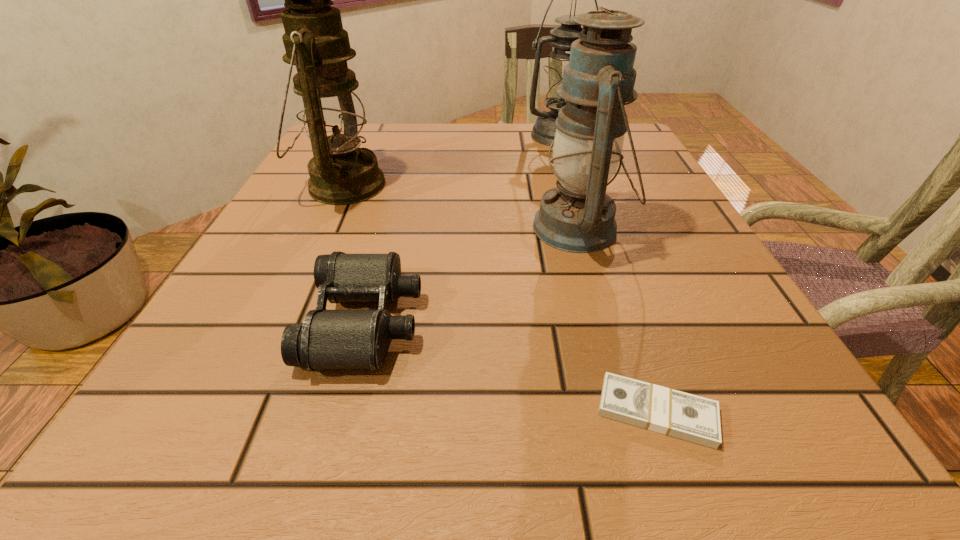
This screenshot has width=960, height=540. I want to click on binoculars located in the left edge section of the desktop, so click(327, 339).

The image size is (960, 540). I want to click on dollar located in the right edge section of the desktop, so click(696, 419).

Identify the location of object that is positioned at the far left corner. This screenshot has width=960, height=540. (329, 103).

I want to click on object located at the far right corner, so click(561, 38).

Image resolution: width=960 pixels, height=540 pixels. Identify the location of object at the near right corner. (696, 419).

In the image, there is a desktop. Where is `vacant region at the far edge`? This screenshot has width=960, height=540. vacant region at the far edge is located at coordinates [497, 137].

This screenshot has height=540, width=960. Identify the location of vacant space at the near edge of the desktop. (628, 468).

Locate an element on the screen. The height and width of the screenshot is (540, 960). vacant area at the left edge is located at coordinates (297, 272).

This screenshot has width=960, height=540. In the image, there is a desktop. What are the coordinates of `vacant region at the right edge` in the screenshot? It's located at (635, 204).

The height and width of the screenshot is (540, 960). I want to click on vacant region at the far left corner of the desktop, so [377, 126].